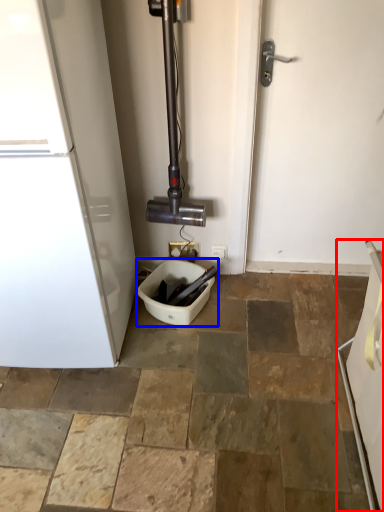
Question: Which object is closer to the camera taking this photo, appliance (highlighted by a red box) or toilet bowl (highlighted by a blue box)?

Choices:
 (A) appliance
 (B) toilet bowl

Answer: (A)